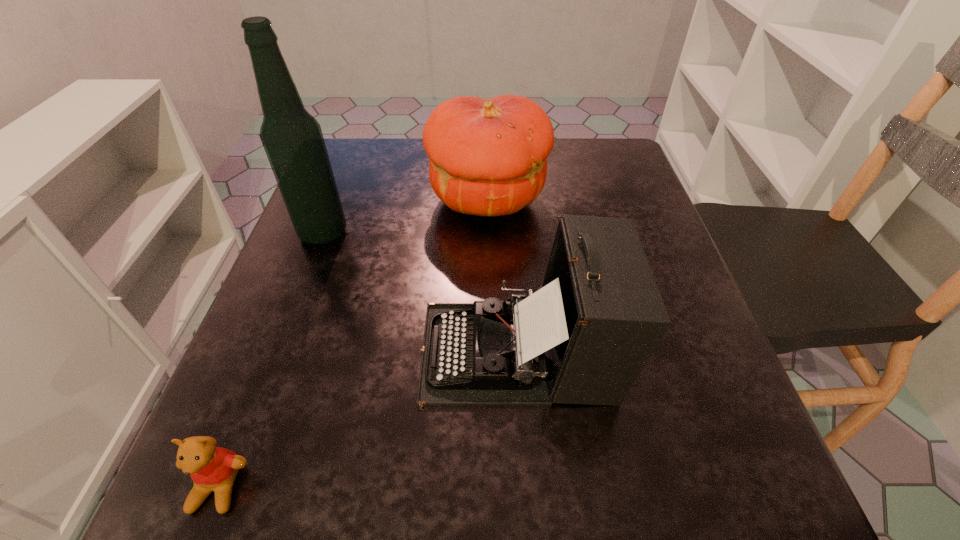
The width and height of the screenshot is (960, 540). Identify the location of free point between the pumpkin and the nearest object. (353, 343).

The image size is (960, 540). In order to click on unoccupied position between the shortest object and the alcohol in this screenshot , I will do `click(271, 360)`.

Image resolution: width=960 pixels, height=540 pixels. Find the location of `object that ranks as the third closest to the third farthest object`. object that ranks as the third closest to the third farthest object is located at coordinates pyautogui.click(x=292, y=138).

Choose which object is the nearest neighbor to the nearest object. Please provide its 2D coordinates. Your answer should be formatted as a tuple, i.e. [(x, y)], where the tuple contains the x and y coordinates of a point satisfying the conditions above.

[(583, 338)]

This screenshot has width=960, height=540. What are the coordinates of `vacant area that satisfies the following two spatial constraints: 1. inside the open case of the typewriter; 2. on the front-facing side of the nearest object` in the screenshot? It's located at (529, 487).

Identify the location of blank area in the image that satisfies the following two spatial constraints: 1. inside the open case of the second nearest object; 2. on the front-facing side of the teddy bear. (529, 487).